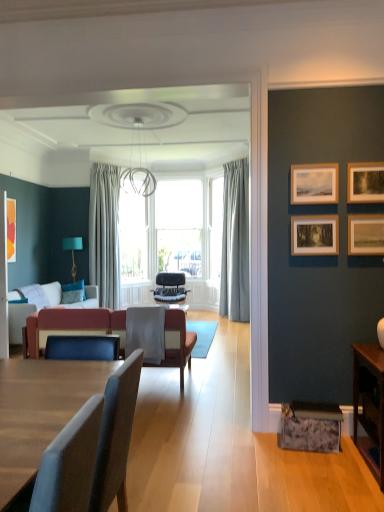
Image resolution: width=384 pixels, height=512 pixels. I want to click on free region on the left part of wooden table at lower right, so click(324, 471).